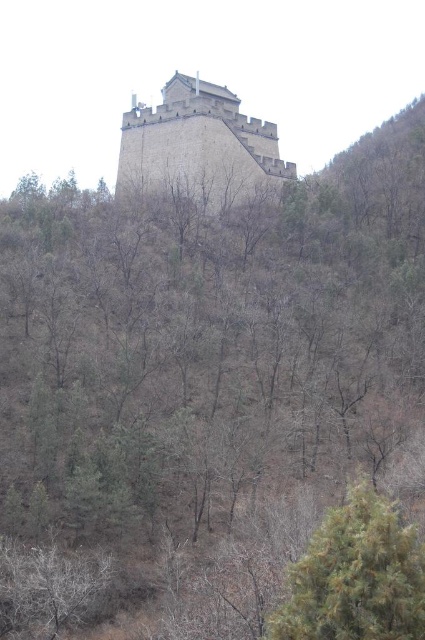
Is green textured tree at lower right positioned before gray stone tower at center?

Yes, green textured tree at lower right is closer to the viewer.

Which is above, green textured tree at lower right or gray stone tower at center?

Positioned higher is gray stone tower at center.

Between point (328, 554) and point (286, 168), which one is positioned behind?

The point (286, 168) is behind.

Identify the location of green textured tree at lower right. (356, 576).